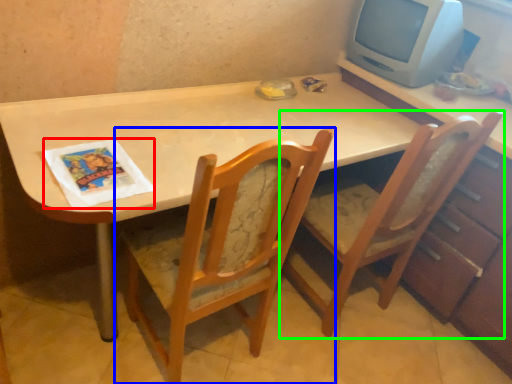
Question: Which is nearer to the magazine (highlighted by a red box)? chair (highlighted by a blue box) or chair (highlighted by a green box).

Choices:
 (A) chair
 (B) chair

Answer: (A)